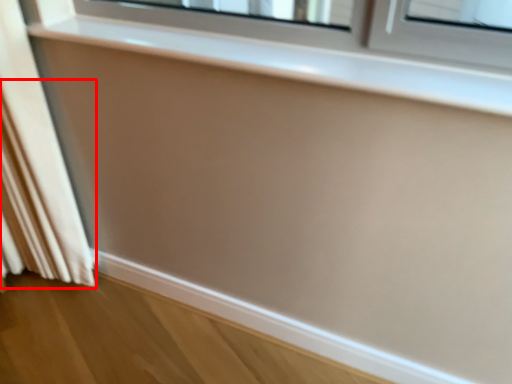
Question: Where is curtain (annotated by the red box) located in relation to window sill in the image?

Choices:
 (A) left
 (B) right

Answer: (A)